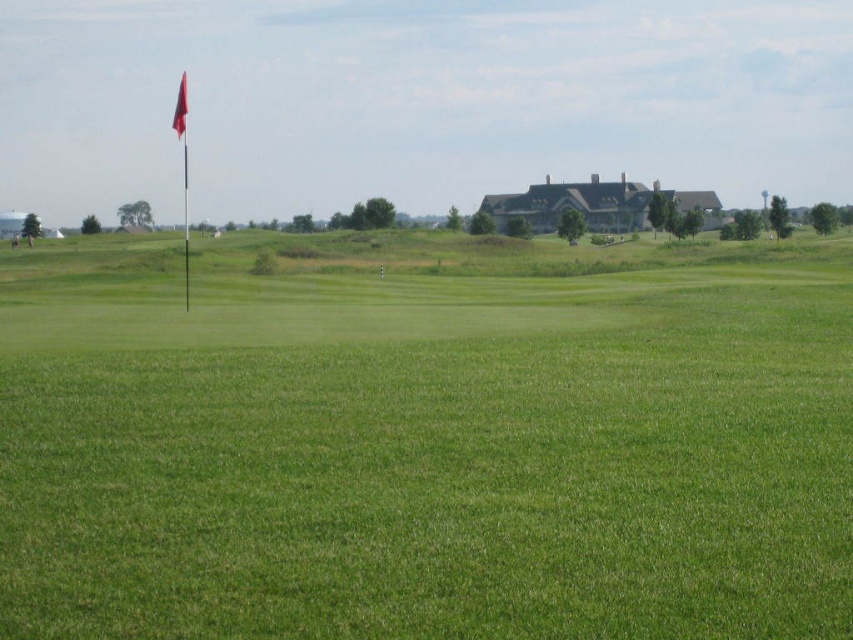
Question: Based on their relative distances, which object is nearer to the red fabric flag at upper left?

Choices:
 (A) green grass at center
 (B) metallic flag pole at upper left

Answer: (B)

Question: Is metallic flag pole at upper left in front of red fabric flag at upper left?

Choices:
 (A) yes
 (B) no

Answer: (A)

Question: Observing the image, what is the correct spatial positioning of green grass at center in reference to metallic flag pole at upper left?

Choices:
 (A) left
 (B) right

Answer: (B)

Question: Does green grass at center appear on the left side of red fabric flag at upper left?

Choices:
 (A) yes
 (B) no

Answer: (B)

Question: Among these objects, which one is farthest from the camera?

Choices:
 (A) green grass at center
 (B) red fabric flag at upper left
 (C) metallic flag pole at upper left

Answer: (B)

Question: Which of the following is the farthest from the observer?

Choices:
 (A) green grass at center
 (B) metallic flag pole at upper left

Answer: (B)